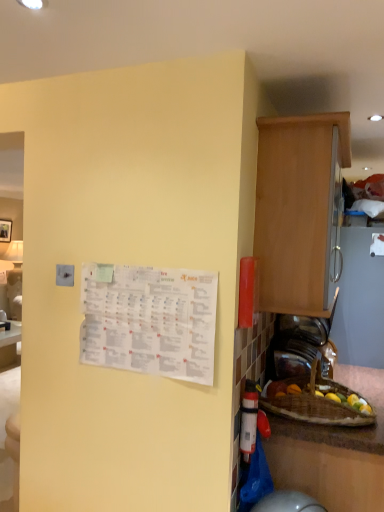
I want to click on light brown wood cabinet at right, so click(298, 208).

The width and height of the screenshot is (384, 512). Describe the element at coordinates (298, 208) in the screenshot. I see `light brown wood cabinet at right` at that location.

This screenshot has width=384, height=512. Describe the element at coordinates (149, 320) in the screenshot. I see `white paper calendar at upper left` at that location.

Where is `white paper calendar at upper left`? The width and height of the screenshot is (384, 512). white paper calendar at upper left is located at coordinates (149, 320).

The width and height of the screenshot is (384, 512). I want to click on light brown wood cabinet at right, so click(x=298, y=208).

Can you confirm if white paper calendar at upper left is positioned to the right of light brown wood cabinet at right?

No, white paper calendar at upper left is not to the right of light brown wood cabinet at right.

Considering the positions of objects white paper calendar at upper left and light brown wood cabinet at right in the image provided, who is in front, white paper calendar at upper left or light brown wood cabinet at right?

Positioned in front is white paper calendar at upper left.

Considering the points (139, 336) and (268, 304), which point is in front, point (139, 336) or point (268, 304)?

The point (139, 336) is closer to the camera.

From the image's perspective, is white paper calendar at upper left on top of light brown wood cabinet at right?

No, from the image's perspective, white paper calendar at upper left is not on top of light brown wood cabinet at right.

From a real-world perspective, is white paper calendar at upper left located higher than light brown wood cabinet at right?

No, from a real-world perspective, white paper calendar at upper left is not over light brown wood cabinet at right

Looking at their sizes, would you say white paper calendar at upper left is wider or thinner than light brown wood cabinet at right?

white paper calendar at upper left is thinner than light brown wood cabinet at right.

In the scene shown: Does white paper calendar at upper left have a greater height compared to light brown wood cabinet at right?

In fact, white paper calendar at upper left may be shorter than light brown wood cabinet at right.

Does white paper calendar at upper left have a larger size compared to light brown wood cabinet at right?

Actually, white paper calendar at upper left might be smaller than light brown wood cabinet at right.

Is white paper calendar at upper left not within light brown wood cabinet at right?

That's correct, white paper calendar at upper left is outside of light brown wood cabinet at right.

Is white paper calendar at upper left next to light brown wood cabinet at right and touching it?

white paper calendar at upper left and light brown wood cabinet at right are not in contact.

Could you tell me if white paper calendar at upper left is turned towards light brown wood cabinet at right?

No, white paper calendar at upper left is not facing towards light brown wood cabinet at right.

Where is `cabinetry located on the right of white paper calendar at upper left`? The image size is (384, 512). cabinetry located on the right of white paper calendar at upper left is located at coordinates (298, 208).

Is light brown wood cabinet at right to the left of white paper calendar at upper left from the viewer's perspective?

Incorrect, light brown wood cabinet at right is not on the left side of white paper calendar at upper left.

Relative to white paper calendar at upper left, is light brown wood cabinet at right in front or behind?

Result: light brown wood cabinet at right is behind white paper calendar at upper left.

Is point (292, 230) closer to viewer compared to point (130, 281)?

No, it is not.

From the image's perspective, is light brown wood cabinet at right on top of white paper calendar at upper left?

Yes.

From a real-world perspective, is light brown wood cabinet at right under white paper calendar at upper left?

No.

Which object is wider, light brown wood cabinet at right or white paper calendar at upper left?

light brown wood cabinet at right.

Considering the relative sizes of light brown wood cabinet at right and white paper calendar at upper left in the image provided, is light brown wood cabinet at right shorter than white paper calendar at upper left?

Incorrect, the height of light brown wood cabinet at right does not fall short of that of white paper calendar at upper left.

Based on their sizes in the image, would you say light brown wood cabinet at right is bigger or smaller than white paper calendar at upper left?

In the image, light brown wood cabinet at right appears to be larger than white paper calendar at upper left.

Is light brown wood cabinet at right inside the boundaries of white paper calendar at upper left, or outside?

light brown wood cabinet at right cannot be found inside white paper calendar at upper left.

Is light brown wood cabinet at right directly adjacent to white paper calendar at upper left?

A: There is a gap between light brown wood cabinet at right and white paper calendar at upper left.

Is light brown wood cabinet at right facing away from white paper calendar at upper left?

Result: No, light brown wood cabinet at right is not facing away from white paper calendar at upper left.

How different are the orientations of light brown wood cabinet at right and white paper calendar at upper left in degrees?

light brown wood cabinet at right and white paper calendar at upper left are facing 90.2 degrees away from each other.

How distant is light brown wood cabinet at right from white paper calendar at upper left?

light brown wood cabinet at right is 50.15 centimeters away from white paper calendar at upper left.

This screenshot has height=512, width=384. What are the coordinates of `cabinetry that is behind the white paper calendar at upper left` in the screenshot? It's located at (298, 208).

At what (x,y) coordinates should I click in order to perform the action: click on cabinetry behind the white paper calendar at upper left. Please return your answer as a coordinate pair (x, y). The image size is (384, 512). Looking at the image, I should click on (298, 208).

Locate an element on the screen. Image resolution: width=384 pixels, height=512 pixels. cabinetry located on the right of white paper calendar at upper left is located at coordinates (298, 208).